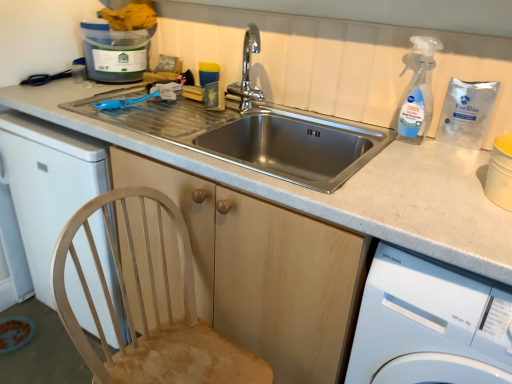
Locate an element on the screen. The height and width of the screenshot is (384, 512). vacant region in front of transparent plastic spray bottle at upper right is located at coordinates (404, 155).